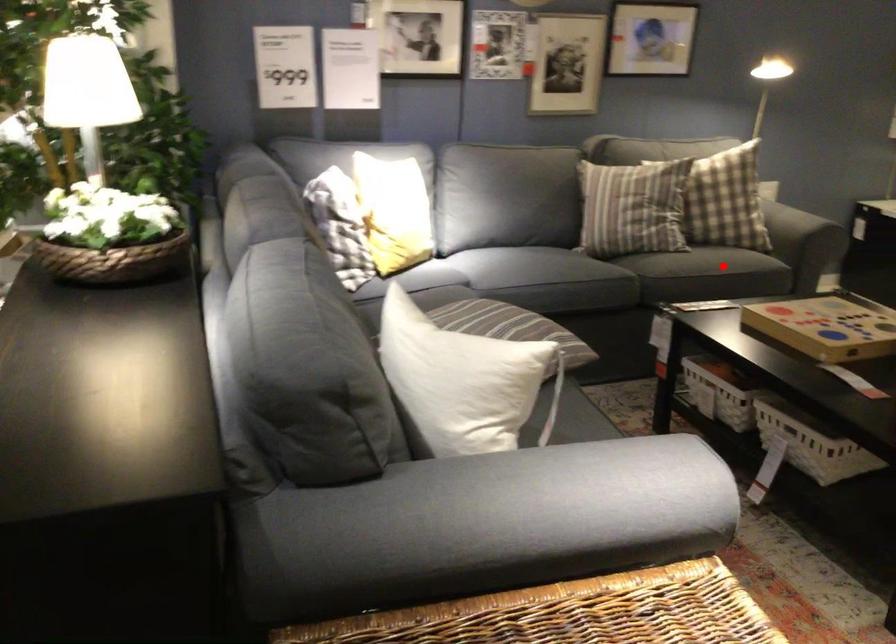
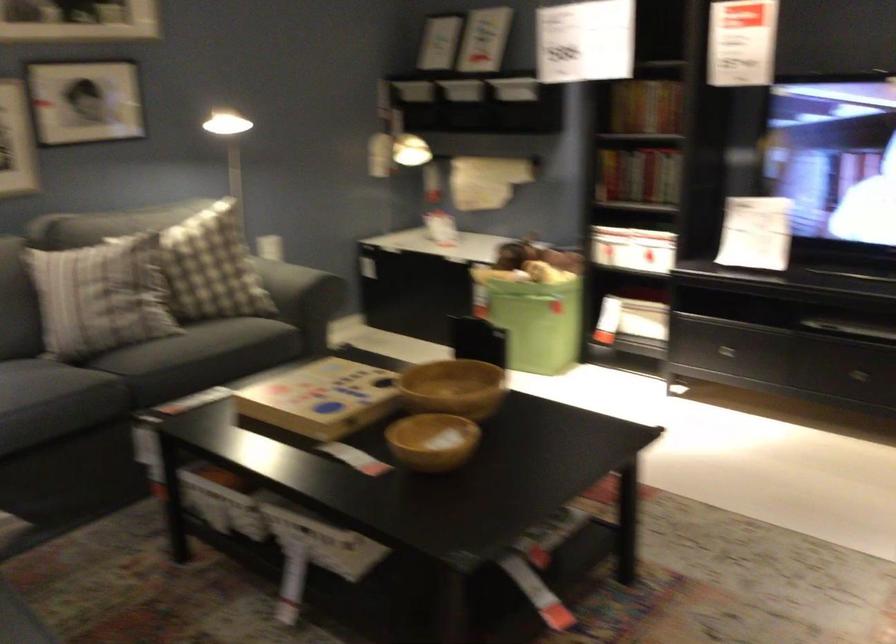
The point at the highlighted location is marked in the first image. Where is the corresponding point in the second image?

(199, 357)